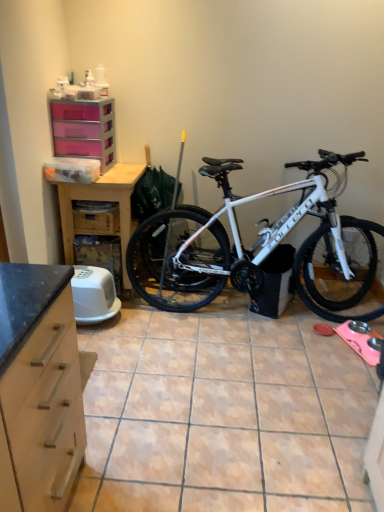
Question: Is the surface of white matte bicycle at center in direct contact with porcelain tile at center?

Choices:
 (A) no
 (B) yes

Answer: (A)

Question: Does white matte bicycle at center have a smaller size compared to porcelain tile at center?

Choices:
 (A) yes
 (B) no

Answer: (B)

Question: Is porcelain tile at center completely or partially inside white matte bicycle at center?

Choices:
 (A) no
 (B) yes

Answer: (A)

Question: Considering the relative positions of white matte bicycle at center and porcelain tile at center in the image provided, is white matte bicycle at center to the right of porcelain tile at center from the viewer's perspective?

Choices:
 (A) no
 (B) yes

Answer: (B)

Question: Is white matte bicycle at center facing away from porcelain tile at center?

Choices:
 (A) no
 (B) yes

Answer: (A)

Question: From the image's perspective, is white matte bicycle at center above or below wooden table at left?

Choices:
 (A) below
 (B) above

Answer: (A)

Question: In the image, is white matte bicycle at center positioned in front of or behind wooden table at left?

Choices:
 (A) behind
 (B) front

Answer: (B)

Question: Is white matte bicycle at center bigger or smaller than wooden table at left?

Choices:
 (A) big
 (B) small

Answer: (A)

Question: From a real-world perspective, is white matte bicycle at center physically located above or below wooden table at left?

Choices:
 (A) below
 (B) above

Answer: (B)

Question: Is porcelain tile at center taller or shorter than brown cardboard crate at lower left?

Choices:
 (A) tall
 (B) short

Answer: (B)

Question: Considering the positions of porcelain tile at center and brown cardboard crate at lower left in the image, is porcelain tile at center wider or thinner than brown cardboard crate at lower left?

Choices:
 (A) thin
 (B) wide

Answer: (B)

Question: In the image, is porcelain tile at center positioned in front of or behind brown cardboard crate at lower left?

Choices:
 (A) front
 (B) behind

Answer: (A)

Question: From the image's perspective, relative to brown cardboard crate at lower left, is porcelain tile at center above or below?

Choices:
 (A) below
 (B) above

Answer: (A)

Question: Is point (x=375, y=237) positioned closer to the camera than point (x=112, y=132)?

Choices:
 (A) farther
 (B) closer

Answer: (A)

Question: In terms of width, does white matte bicycle at center look wider or thinner when compared to pink plastic drawers at upper left?

Choices:
 (A) wide
 (B) thin

Answer: (A)